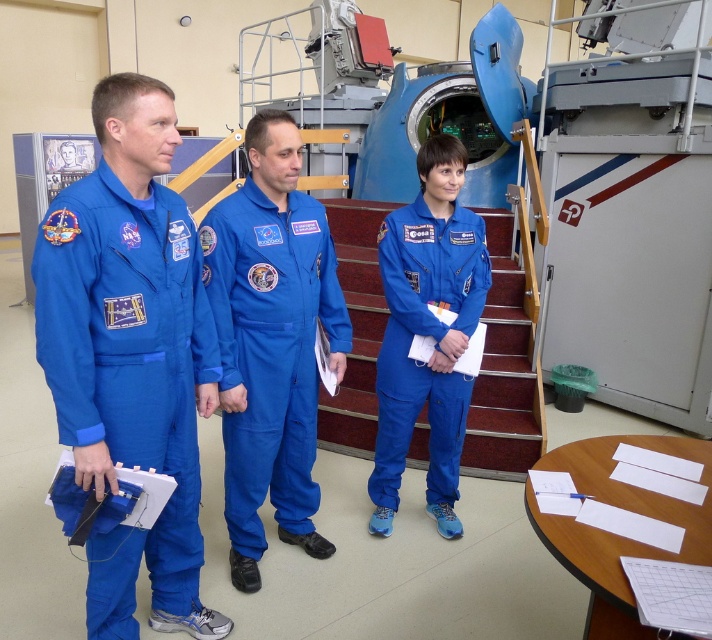
Question: Which point is farther to the camera?

Choices:
 (A) (384, 244)
 (B) (172, 136)
 (C) (362, 428)

Answer: (C)

Question: In this image, where is blue smooth jumpsuit at center located relative to blue fabric jumpsuit at center?

Choices:
 (A) right
 (B) left

Answer: (B)

Question: Can you confirm if blue smooth jumpsuit at center is wider than maroon carpeted stairs at center?

Choices:
 (A) no
 (B) yes

Answer: (A)

Question: Among these objects, which one is nearest to the camera?

Choices:
 (A) maroon carpeted stairs at center
 (B) blue fabric jumpsuit at center
 (C) blue smooth jumpsuit at center
 (D) matte blue jumpsuit at left

Answer: (D)

Question: Does blue smooth jumpsuit at center have a smaller size compared to maroon carpeted stairs at center?

Choices:
 (A) no
 (B) yes

Answer: (B)

Question: Which of the following is the farthest from the observer?

Choices:
 (A) (187, 476)
 (B) (268, 401)

Answer: (B)